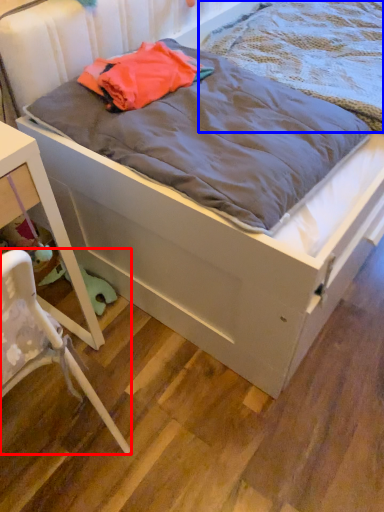
Question: Which point is further to the camera, chair (highlighted by a red box) or blanket (highlighted by a blue box)?

Choices:
 (A) chair
 (B) blanket

Answer: (B)